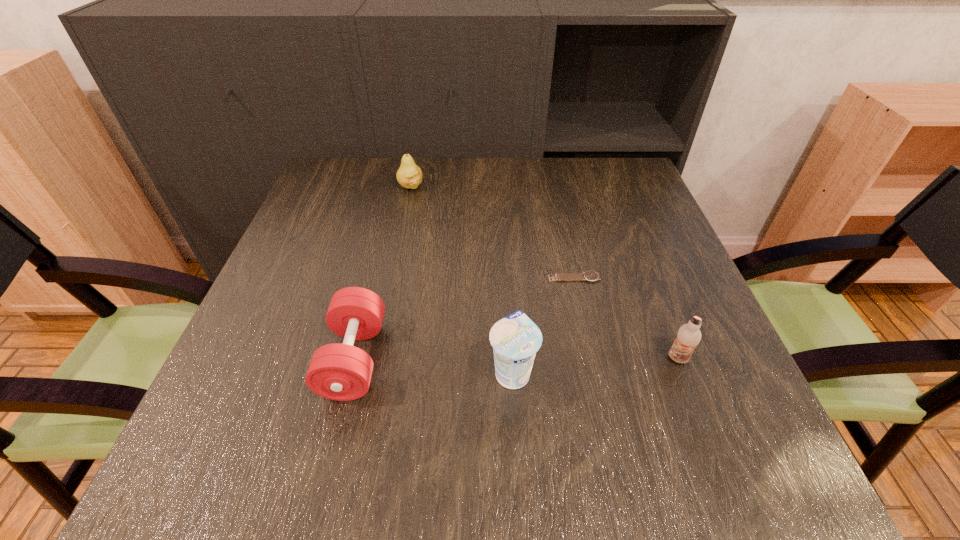
You are a GUI agent. You are given a task and a screenshot of the screen. Output one action in this format:
    pyautogui.click(x=<x>, y=<y>)
    Task: Click on the vacant space that satisfies the following two spatial constraints: 1. on the front side of the second object from right to left; 2. on the right side of the chocolate milk
    
    Given the screenshot: What is the action you would take?
    pyautogui.click(x=591, y=359)

At what (x,y) coordinates should I click in order to perform the action: click on vacant area in the image that satisfies the following two spatial constraints: 1. on the back side of the farthest object; 2. on the right side of the dumbbell. Please return your answer as a coordinate pair (x, y). This screenshot has width=960, height=540. Looking at the image, I should click on (396, 186).

The width and height of the screenshot is (960, 540). Find the location of `free region that satisfies the following two spatial constraints: 1. on the front side of the dumbbell; 2. on the left side of the third object from right to left`. free region that satisfies the following two spatial constraints: 1. on the front side of the dumbbell; 2. on the left side of the third object from right to left is located at coordinates coord(351,372).